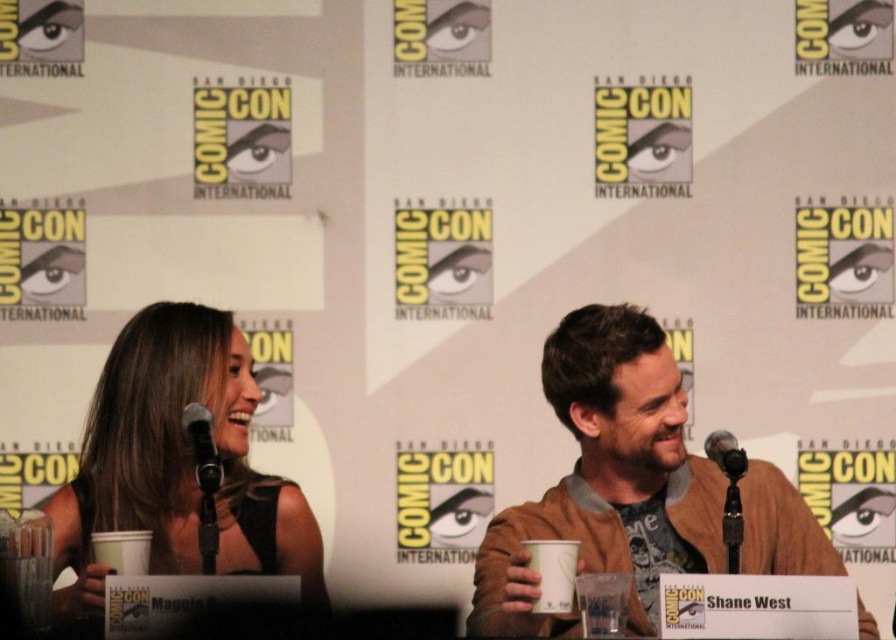
You are a photographer at Comic Con and you want to take a photo of the black matte dress at left and the black metallic microphone at right. The minimum distance required for your camera to focus properly is 3.5 feet. Can you take a clear photo of both objects without moving them?

The black matte dress at left is 3.40 feet away from the black metallic microphone at right, which is less than the 3.5 feet required for proper focus. Therefore, the camera may not be able to focus properly on both objects simultaneously.

Based on the photo, you are organizing a panel at Comic Con and need to place a decorative stand between the brown leather jacket at center and the black metallic microphone at right. Since the stand requires 10 cm of space, will there be enough room between them?

The brown leather jacket at center is taller than the black metallic microphone at right, but the question is about the space between them. The description only provides information about their heights, not the distance between them. Therefore, we cannot determine if there is enough space for the stand based on the given information.

You are attending Comic Con and want to take a photo of the brown leather jacket at center and the black metallic microphone at right. Which object should you focus on first to ensure both are in frame?

You should focus on the brown leather jacket at center first since it is in front of the black metallic microphone at right, ensuring both are visible in the photo.